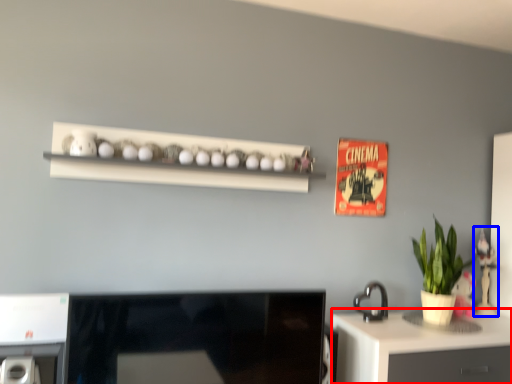
Question: Among these objects, which one is nearest to the camera, desk (highlighted by a red box) or toy (highlighted by a blue box)?

Choices:
 (A) desk
 (B) toy

Answer: (A)